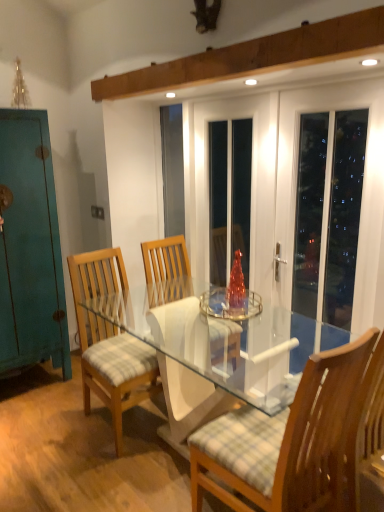
Question: Can you see light brown wood chair at center, which is the 1th chair from left to right, touching teal matte cabinet at left?

Choices:
 (A) no
 (B) yes

Answer: (A)

Question: Is teal matte cabinet at left surrounded by light brown wood chair at center, the second chair viewed from the right?

Choices:
 (A) no
 (B) yes

Answer: (A)

Question: From the image's perspective, would you say light brown wood chair at center, which is the 1th chair from left to right, is positioned over teal matte cabinet at left?

Choices:
 (A) no
 (B) yes

Answer: (A)

Question: Does light brown wood chair at center, which ranks as the 2th chair in front-to-back order, appear on the left side of teal matte cabinet at left?

Choices:
 (A) no
 (B) yes

Answer: (A)

Question: Does light brown wood chair at center, the second chair viewed from the right, come in front of teal matte cabinet at left?

Choices:
 (A) no
 (B) yes

Answer: (B)

Question: From the image's perspective, relative to wooden chair with checkered cushion at center, marked as the second chair in a back-to-front arrangement, is white glossy door at upper right above or below?

Choices:
 (A) above
 (B) below

Answer: (A)

Question: Would you say white glossy door at upper right is to the left or to the right of wooden chair with checkered cushion at center, marked as the second chair in a back-to-front arrangement, in the picture?

Choices:
 (A) left
 (B) right

Answer: (B)

Question: Which is correct: white glossy door at upper right is inside wooden chair with checkered cushion at center, the first chair in the front-to-back sequence, or outside of it?

Choices:
 (A) inside
 (B) outside

Answer: (B)

Question: Is white glossy door at upper right taller or shorter than wooden chair with checkered cushion at center, placed as the second chair when sorted from left to right?

Choices:
 (A) short
 (B) tall

Answer: (B)

Question: Relative to wooden chair with checkered cushion at center, the first chair in the front-to-back sequence, is teal matte cabinet at left in front or behind?

Choices:
 (A) behind
 (B) front

Answer: (A)

Question: From a real-world perspective, is teal matte cabinet at left physically located above or below wooden chair with checkered cushion at center, the first chair in the front-to-back sequence?

Choices:
 (A) above
 (B) below

Answer: (A)

Question: Considering the positions of point (48, 131) and point (269, 456), is point (48, 131) closer or farther from the camera than point (269, 456)?

Choices:
 (A) farther
 (B) closer

Answer: (A)

Question: Is teal matte cabinet at left inside the boundaries of wooden chair with checkered cushion at center, marked as the second chair in a back-to-front arrangement, or outside?

Choices:
 (A) inside
 (B) outside

Answer: (B)

Question: In terms of width, does wooden chair with checkered cushion at center, placed as the second chair when sorted from left to right, look wider or thinner when compared to teal matte cabinet at left?

Choices:
 (A) thin
 (B) wide

Answer: (B)

Question: Would you say wooden chair with checkered cushion at center, the first chair in the front-to-back sequence, is inside or outside teal matte cabinet at left?

Choices:
 (A) inside
 (B) outside

Answer: (B)